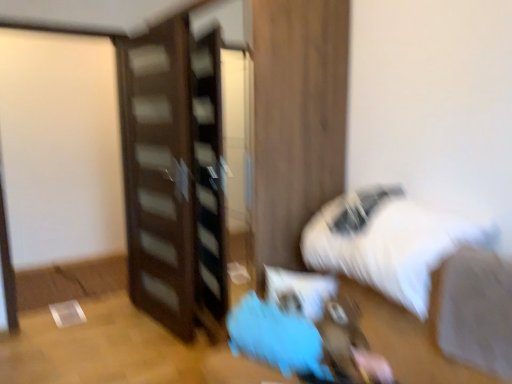
Question: From a real-world perspective, is white fluffy bed at lower right physically below white fabric at lower right?

Choices:
 (A) yes
 (B) no

Answer: (B)

Question: Is white fluffy bed at lower right surrounding white fabric at lower right?

Choices:
 (A) no
 (B) yes

Answer: (A)

Question: From a real-world perspective, is white fluffy bed at lower right on white fabric at lower right?

Choices:
 (A) no
 (B) yes

Answer: (B)

Question: Does white fluffy bed at lower right have a lesser width compared to white fabric at lower right?

Choices:
 (A) yes
 (B) no

Answer: (B)

Question: Is white fluffy bed at lower right positioned in front of white fabric at lower right?

Choices:
 (A) no
 (B) yes

Answer: (A)

Question: Is dark wood dresser at center taller or shorter than white fabric at lower right?

Choices:
 (A) tall
 (B) short

Answer: (A)

Question: Does point (x=187, y=233) appear closer or farther from the camera than point (x=495, y=359)?

Choices:
 (A) closer
 (B) farther

Answer: (B)

Question: In the image, is dark wood dresser at center positioned in front of or behind white fabric at lower right?

Choices:
 (A) behind
 (B) front

Answer: (A)

Question: In terms of size, does dark wood dresser at center appear bigger or smaller than white fabric at lower right?

Choices:
 (A) big
 (B) small

Answer: (A)

Question: From the image's perspective, relative to white fluffy bed at lower right, is dark wood dresser at center above or below?

Choices:
 (A) below
 (B) above

Answer: (B)

Question: Is dark wood dresser at center bigger or smaller than white fluffy bed at lower right?

Choices:
 (A) big
 (B) small

Answer: (A)

Question: Choose the correct answer: Is dark wood dresser at center inside white fluffy bed at lower right or outside it?

Choices:
 (A) inside
 (B) outside

Answer: (B)

Question: From a real-world perspective, is dark wood dresser at center above or below white fluffy bed at lower right?

Choices:
 (A) below
 (B) above

Answer: (B)

Question: Based on their sizes in the image, would you say dark wood dresser at center is bigger or smaller than blue fabric bean bag at lower center?

Choices:
 (A) small
 (B) big

Answer: (B)

Question: From a real-world perspective, is dark wood dresser at center physically located above or below blue fabric bean bag at lower center?

Choices:
 (A) below
 (B) above

Answer: (B)